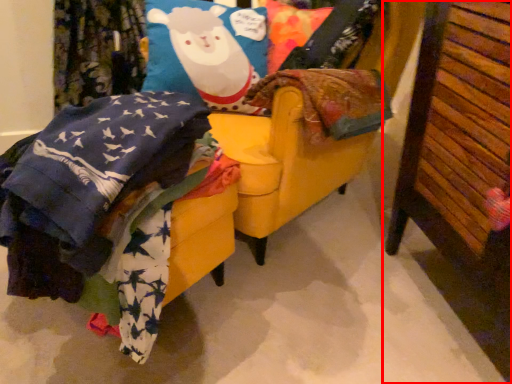
Question: Where is furniture (annotated by the red box) located in relation to swivel chair in the image?

Choices:
 (A) right
 (B) left

Answer: (A)